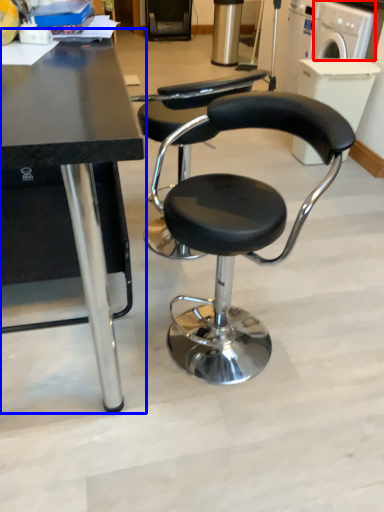
Question: Which of the following is the closest to the observer, washing machine (highlighted by a red box) or table (highlighted by a blue box)?

Choices:
 (A) washing machine
 (B) table

Answer: (B)